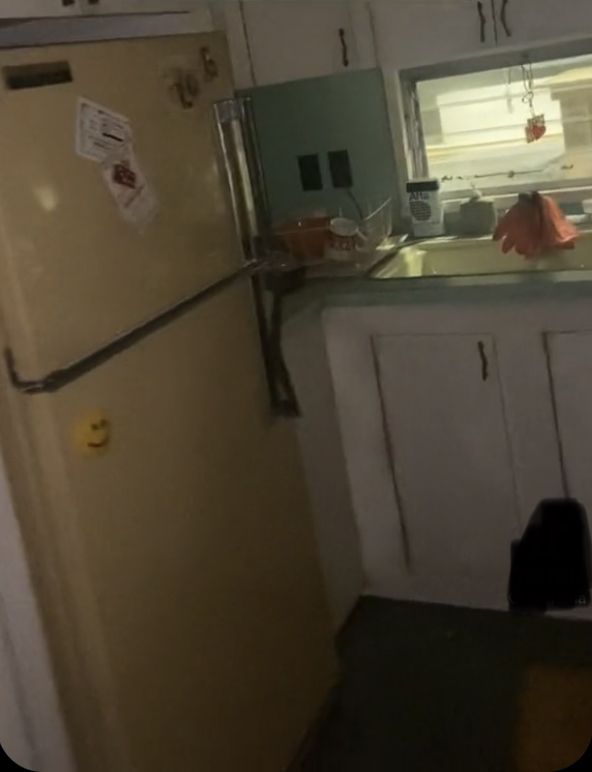
The image size is (592, 772). In order to click on refridgerator in this screenshot , I will do `click(149, 503)`.